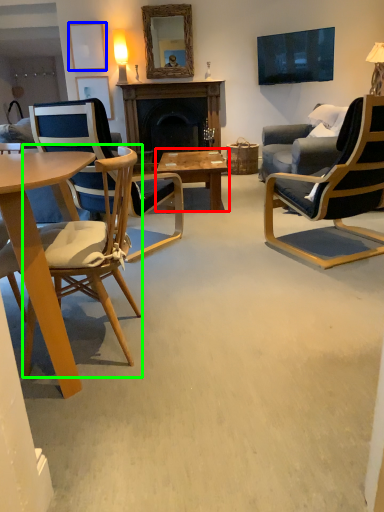
Question: Which is nearer to the coffee table (highlighted by a red box)? picture frame (highlighted by a blue box) or chair (highlighted by a green box).

Choices:
 (A) picture frame
 (B) chair

Answer: (B)